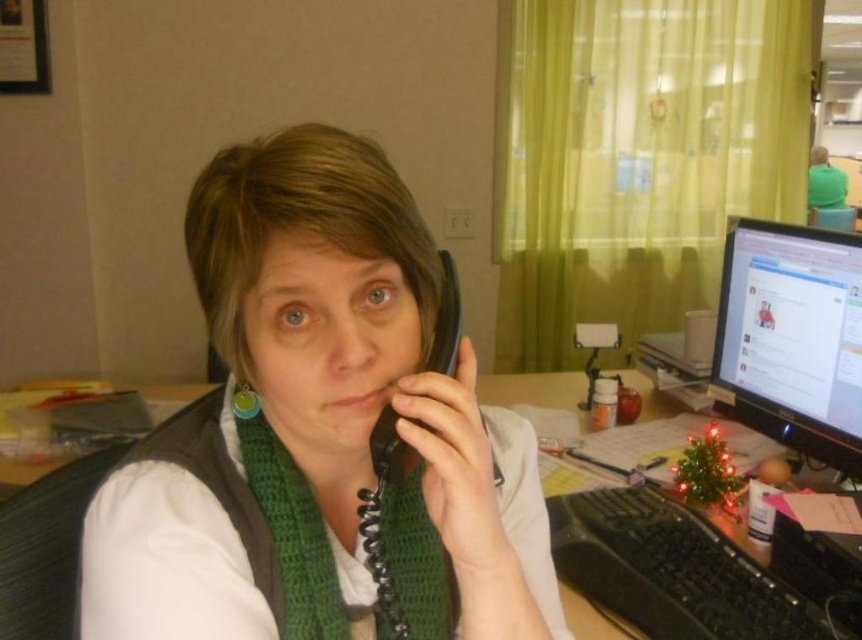
Who is higher up, white matte vest at center or green knitted scarf at center?

white matte vest at center is higher up.

Between white matte vest at center and green knitted scarf at center, which one is positioned lower?

green knitted scarf at center is below.

This screenshot has width=862, height=640. Describe the element at coordinates (360, 394) in the screenshot. I see `white matte vest at center` at that location.

I want to click on white matte vest at center, so click(360, 394).

Between green knitted scarf at center and black rubberized phone at center, which one has more height?

Standing taller between the two is green knitted scarf at center.

In the scene shown: Is green knitted scarf at center further to the viewer compared to black rubberized phone at center?

Yes, it is behind black rubberized phone at center.

Is point (384, 548) more distant than point (448, 317)?

No, it is in front of (448, 317).

Locate an element on the screen. green knitted scarf at center is located at coordinates (292, 536).

Between black glossy monitor at right and black plastic keyboard at center, which one has less height?

black plastic keyboard at center

Which is above, black glossy monitor at right or black plastic keyboard at center?

Positioned higher is black glossy monitor at right.

This screenshot has height=640, width=862. What do you see at coordinates (792, 337) in the screenshot?
I see `black glossy monitor at right` at bounding box center [792, 337].

Where is `black glossy monitor at right`? The height and width of the screenshot is (640, 862). black glossy monitor at right is located at coordinates (792, 337).